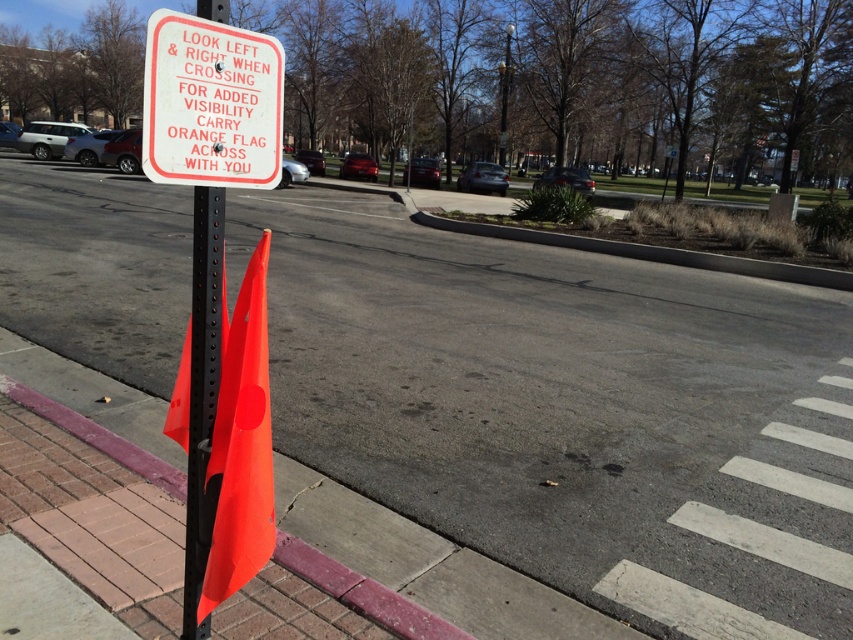
Who is higher up, black textured pole at left or brick at lower left?

Positioned higher is black textured pole at left.

Does black textured pole at left appear over brick at lower left?

Yes, black textured pole at left is above brick at lower left.

Between point (218, 218) and point (80, 429), which one is positioned in front?

Point (218, 218)

Identify the location of black textured pole at left. Image resolution: width=853 pixels, height=640 pixels. (202, 396).

Who is shorter, orange fabric traffic cone at left or brick at lower left?

brick at lower left

Is orange fabric traffic cone at left below brick at lower left?

No.

Who is more distant from viewer, (201,614) or (311,552)?

Positioned behind is point (311,552).

At what (x,y) coordinates should I click in order to perform the action: click on orange fabric traffic cone at left. Please return your answer as a coordinate pair (x, y). The image size is (853, 640). Looking at the image, I should click on (241, 445).

Does point (177, 44) come behind point (199, 448)?

No, it is not.

Between point (148, 173) and point (189, 536), which one is positioned in front?

Point (148, 173) is in front.

You are a GUI agent. You are given a task and a screenshot of the screen. Output one action in this format:
    pyautogui.click(x=<x>, y=<y>)
    Task: Click on the white plastic sign at upper center
    The image size is (853, 640).
    Given the screenshot: What is the action you would take?
    pyautogui.click(x=212, y=102)